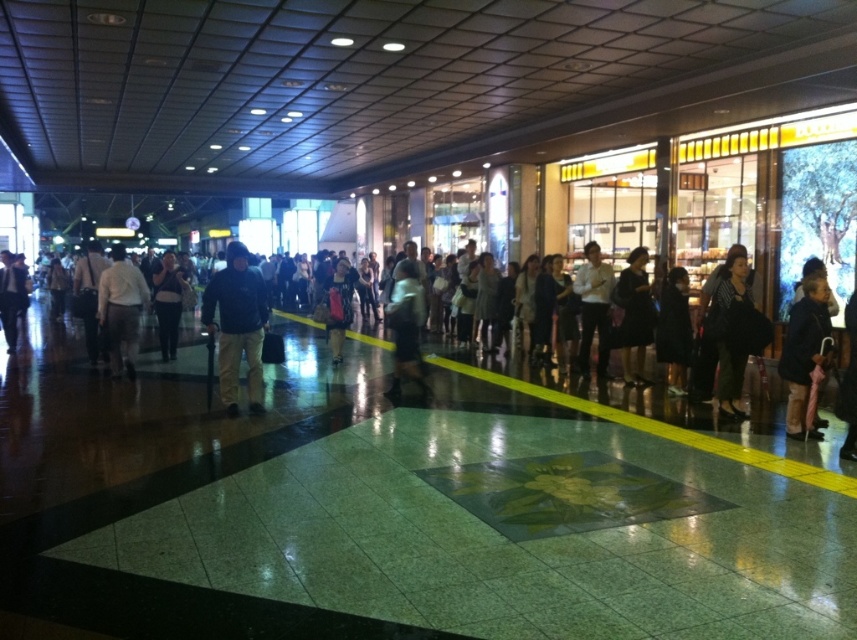
Question: Can you confirm if dark gray coat at right is smaller than matte black jacket at center?

Choices:
 (A) yes
 (B) no

Answer: (A)

Question: Which object is closer to the camera taking this photo?

Choices:
 (A) dark blue fabric at center
 (B) light brown leather jacket at center
 (C) light gray fabric jacket at center
 (D) white matte shirt at center

Answer: (A)

Question: Which of these objects is positioned farthest from the dark gray coat at right?

Choices:
 (A) dark blue fabric at center
 (B) light brown leather jacket at center

Answer: (B)

Question: Can you confirm if dark gray fabric coat at center is wider than light gray fabric jacket at center?

Choices:
 (A) yes
 (B) no

Answer: (A)

Question: Is white matte shirt at center positioned in front of dark gray coat at right?

Choices:
 (A) yes
 (B) no

Answer: (B)

Question: Which point appears closest to the camera in this image?

Choices:
 (A) (580, 301)
 (B) (639, 326)
 (C) (678, 273)
 (D) (175, 324)

Answer: (C)